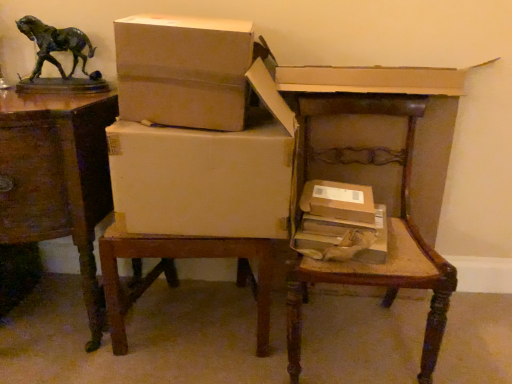
Where is `vacant region below wooden table at left (from a real-world perspective)`? This screenshot has height=384, width=512. vacant region below wooden table at left (from a real-world perspective) is located at coordinates (42, 318).